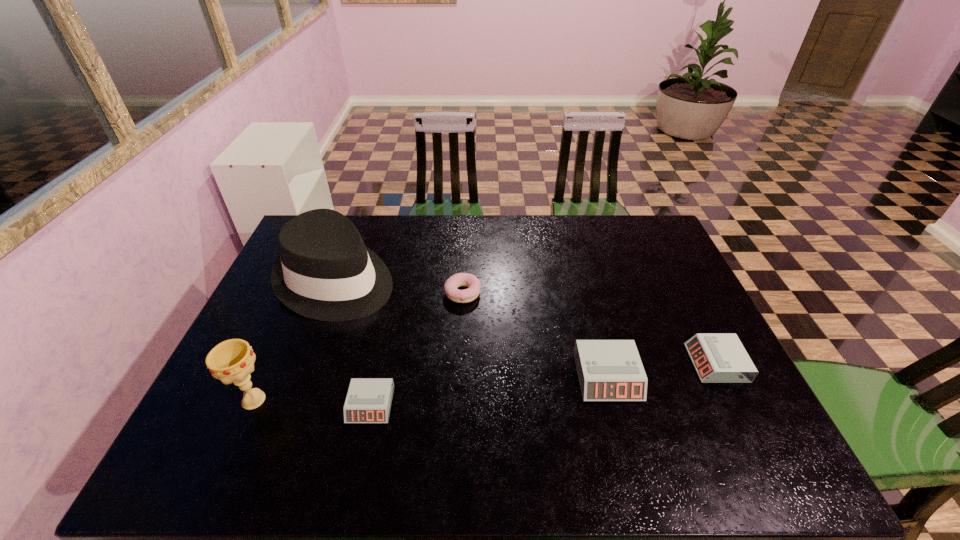
This screenshot has height=540, width=960. In order to click on free space that satisfies the following two spatial constraints: 1. on the front side of the doughnut; 2. on the right side of the second tallest alarm clock in this screenshot , I will do `click(460, 363)`.

The width and height of the screenshot is (960, 540). Find the location of `free space that satisfies the following two spatial constraints: 1. on the front side of the chalice; 2. on the right side of the leftmost alarm clock`. free space that satisfies the following two spatial constraints: 1. on the front side of the chalice; 2. on the right side of the leftmost alarm clock is located at coordinates (252, 405).